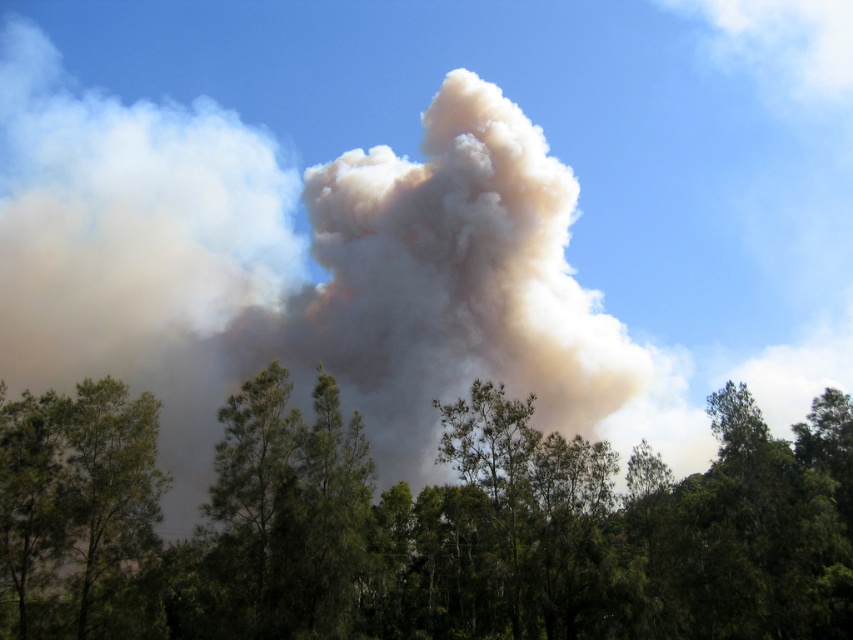
Question: Which point is closer to the camera taking this photo?

Choices:
 (A) (1, 552)
 (B) (749, 632)

Answer: (A)

Question: Does green leafy trees at lower center appear on the left side of green leafy tree at lower left?

Choices:
 (A) yes
 (B) no

Answer: (B)

Question: Can you confirm if green leafy trees at lower center is thinner than green leafy tree at lower left?

Choices:
 (A) no
 (B) yes

Answer: (A)

Question: Which object appears farthest from the camera in this image?

Choices:
 (A) green leafy trees at lower center
 (B) green leafy tree at lower left

Answer: (B)

Question: Which point is farther to the camera?

Choices:
 (A) green leafy trees at lower center
 (B) green leafy tree at lower left

Answer: (B)

Question: Is the position of green leafy trees at lower center less distant than that of green leafy tree at lower left?

Choices:
 (A) yes
 (B) no

Answer: (A)